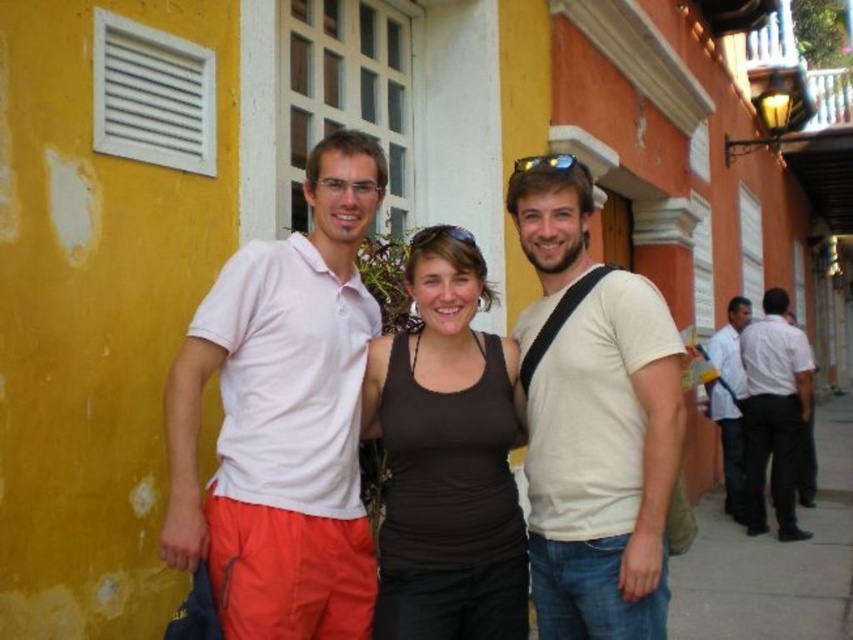
The height and width of the screenshot is (640, 853). Find the location of `white cotton shirt at right`. white cotton shirt at right is located at coordinates coord(775,413).

Is white cotton shirt at right shorter than white shirt at right?

No.

Who is more distant from viewer, (x=808, y=369) or (x=734, y=406)?

Positioned behind is point (x=734, y=406).

In order to click on white cotton shirt at right in this screenshot , I will do `click(775, 413)`.

Is white cotton shirt at center taller than light beige t-shirt at center?

No.

Is white cotton shirt at center smaller than light beige t-shirt at center?

No.

Who is more forward, (302, 387) or (566, 557)?

Point (302, 387) is more forward.

Identify the location of white cotton shirt at center. (283, 417).

Which of these two, white cotton shirt at center or white cotton shirt at right, stands taller?

white cotton shirt at right

In order to click on white cotton shirt at center in this screenshot , I will do `click(283, 417)`.